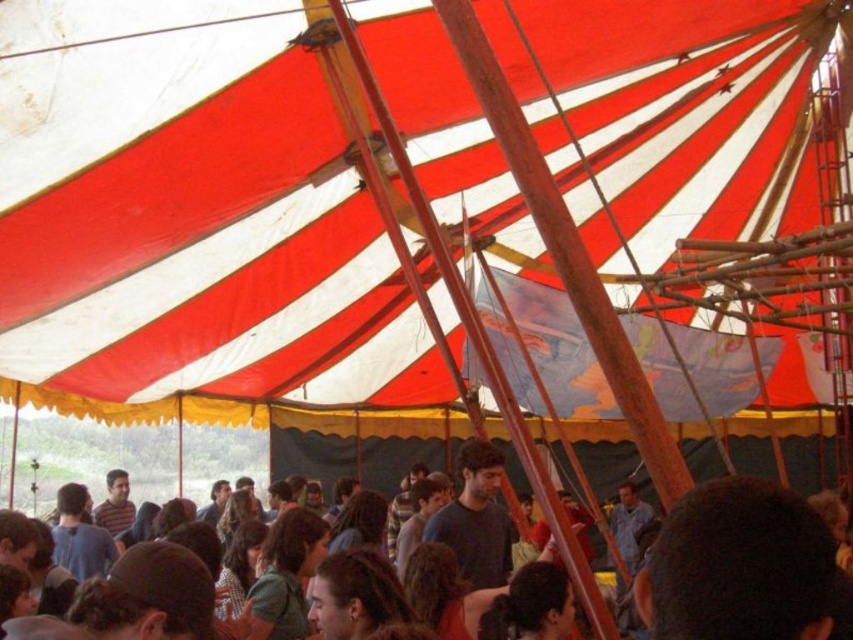
Who is more distant from viewer, (x=654, y=26) or (x=294, y=452)?

The point (x=294, y=452) is behind.

This screenshot has height=640, width=853. I want to click on red/white striped canopy at upper center, so click(x=194, y=228).

Is point (334, 170) farther from viewer compared to point (816, 468)?

No, (334, 170) is in front of (816, 468).

Locate an element on the screen. The width and height of the screenshot is (853, 640). red/white striped canopy at upper center is located at coordinates (194, 228).